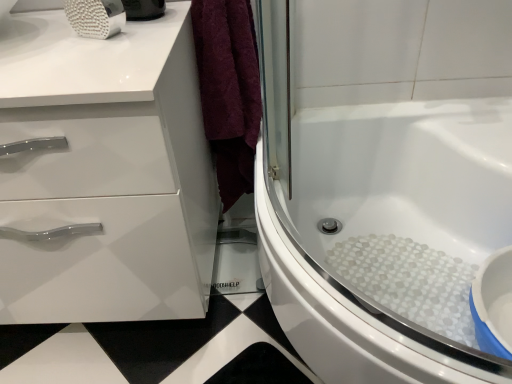
Question: Considering the positions of white textured bath at center and white glossy cabinet at left in the image, is white textured bath at center wider or thinner than white glossy cabinet at left?

Choices:
 (A) wide
 (B) thin

Answer: (A)

Question: From the image's perspective, is white textured bath at center located above or below white glossy cabinet at left?

Choices:
 (A) below
 (B) above

Answer: (A)

Question: Considering the relative positions of white textured bath at center and white glossy cabinet at left in the image provided, is white textured bath at center to the left or to the right of white glossy cabinet at left?

Choices:
 (A) left
 (B) right

Answer: (B)

Question: Would you say white glossy cabinet at left is to the left or to the right of white textured bath at center in the picture?

Choices:
 (A) left
 (B) right

Answer: (A)

Question: Considering the positions of white glossy cabinet at left and white textured bath at center in the image, is white glossy cabinet at left taller or shorter than white textured bath at center?

Choices:
 (A) short
 (B) tall

Answer: (B)

Question: Considering the positions of white glossy cabinet at left and white textured bath at center in the image, is white glossy cabinet at left bigger or smaller than white textured bath at center?

Choices:
 (A) small
 (B) big

Answer: (A)

Question: Relative to white textured bath at center, is white glossy cabinet at left in front or behind?

Choices:
 (A) behind
 (B) front

Answer: (A)